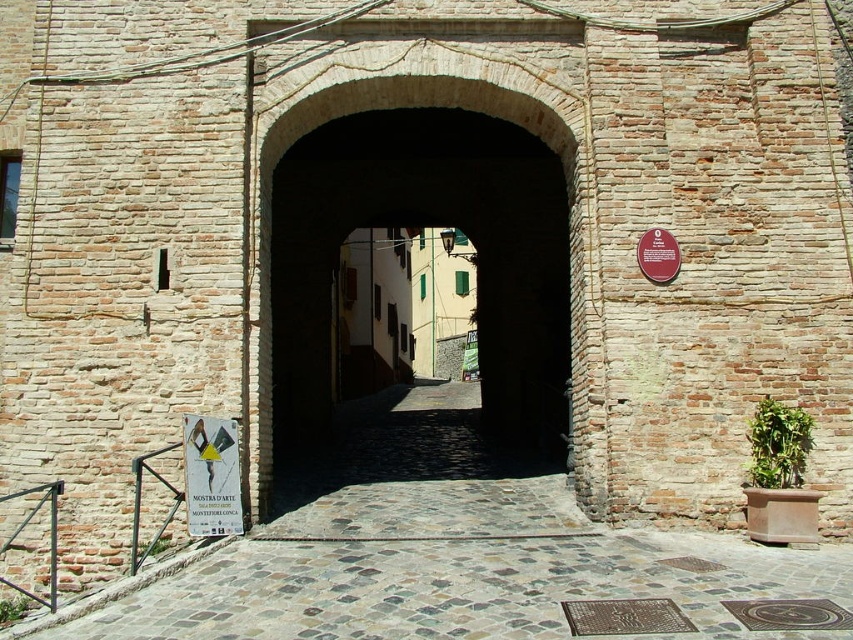
Which of these two, smooth stone alley at center or white paper sign at center, stands taller?

With more height is white paper sign at center.

Is the position of smooth stone alley at center less distant than that of white paper sign at center?

Yes, it is in front of white paper sign at center.

Locate an element on the screen. The width and height of the screenshot is (853, 640). smooth stone alley at center is located at coordinates pyautogui.click(x=444, y=552).

Is smooth stone alley at center shorter than brick archway at center?

Yes.

Can you confirm if smooth stone alley at center is positioned below brick archway at center?

Yes, smooth stone alley at center is below brick archway at center.

The image size is (853, 640). Identify the location of smooth stone alley at center. (444, 552).

You are a GUI agent. You are given a task and a screenshot of the screen. Output one action in this format:
    pyautogui.click(x=<x>, y=<y>)
    Task: Click on the smooth stone alley at center
    The width and height of the screenshot is (853, 640).
    Given the screenshot: What is the action you would take?
    pyautogui.click(x=444, y=552)

Which is more to the right, brick archway at center or white paper sign at center?

From the viewer's perspective, brick archway at center appears more on the right side.

Looking at this image, does brick archway at center have a greater width compared to white paper sign at center?

Yes, brick archway at center is wider than white paper sign at center.

Does point (381, 81) come in front of point (198, 422)?

No, (381, 81) is further to viewer.

Where is `brick archway at center`? The height and width of the screenshot is (640, 853). brick archway at center is located at coordinates (416, 225).